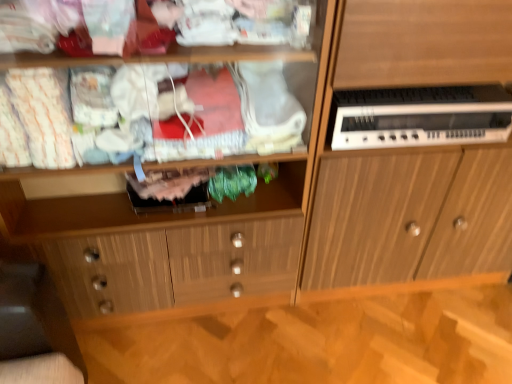
The width and height of the screenshot is (512, 384). In order to click on white plastic electronic device at right in this screenshot , I will do `click(421, 116)`.

Image resolution: width=512 pixels, height=384 pixels. Describe the element at coordinates (199, 139) in the screenshot. I see `wooden cabinet at center` at that location.

The height and width of the screenshot is (384, 512). What are the coordinates of `wooden cabinet at right` in the screenshot? It's located at (411, 159).

Does wooden cabinet at center appear on the right side of white plastic electronic device at right?

No.

Is wooden cabinet at center inside or outside of white plastic electronic device at right?

wooden cabinet at center lies outside white plastic electronic device at right.

The width and height of the screenshot is (512, 384). Find the location of `home appliance located behind the wooden cabinet at center`. home appliance located behind the wooden cabinet at center is located at coordinates (421, 116).

Can you confirm if wooden cabinet at center is positioned to the left of wooden cabinet at right?

Yes, wooden cabinet at center is to the left of wooden cabinet at right.

Between wooden cabinet at center and wooden cabinet at right, which one is positioned behind?

wooden cabinet at right is further from the camera.

Can you confirm if wooden cabinet at center is shorter than wooden cabinet at right?

Correct, wooden cabinet at center is not as tall as wooden cabinet at right.

From the image's perspective, is wooden cabinet at center located beneath wooden cabinet at right?

Correct, wooden cabinet at center appears lower than wooden cabinet at right in the image.

Is white plastic electronic device at right oriented towards wooden cabinet at right?

Yes.

Based on the photo, from the image's perspective, does white plastic electronic device at right appear higher than wooden cabinet at right?

Yes, from the image's perspective, white plastic electronic device at right is on top of wooden cabinet at right.

From a real-world perspective, which object stands above the other?

white plastic electronic device at right.

Is white plastic electronic device at right aimed at wooden cabinet at center?

No, white plastic electronic device at right does not turn towards wooden cabinet at center.

Measure the distance from white plastic electronic device at right to wooden cabinet at center.

15.62 inches.

Which object is closer to the camera, white plastic electronic device at right or wooden cabinet at center?

wooden cabinet at center is closer to the camera.

Is white plastic electronic device at right at the left side of wooden cabinet at center?

In fact, white plastic electronic device at right is to the right of wooden cabinet at center.

How many degrees apart are the facing directions of wooden cabinet at right and wooden cabinet at center?

0.566 degrees.

Considering their positions, is wooden cabinet at right located in front of or behind wooden cabinet at center?

wooden cabinet at right is positioned farther from the viewer than wooden cabinet at center.

From a real-world perspective, is wooden cabinet at right located higher than wooden cabinet at center?

No, from a real-world perspective, wooden cabinet at right is not above wooden cabinet at center.

Can you confirm if wooden cabinet at right is bigger than wooden cabinet at center?

Yes.

Where is `home appliance located above the wooden cabinet at right (from the image's perspective)`? Image resolution: width=512 pixels, height=384 pixels. home appliance located above the wooden cabinet at right (from the image's perspective) is located at coordinates (421, 116).

Between wooden cabinet at right and white plastic electronic device at right, which one has larger size?

wooden cabinet at right is bigger.

Is wooden cabinet at right positioned with its back to white plastic electronic device at right?

Yes, wooden cabinet at right is facing away from white plastic electronic device at right.

Is there a large distance between wooden cabinet at right and white plastic electronic device at right?

That's not correct — wooden cabinet at right is a little close to white plastic electronic device at right.

At what (x,y) coordinates should I click in order to perform the action: click on shelf that appears in front of the white plastic electronic device at right. Please return your answer as a coordinate pair (x, y). The height and width of the screenshot is (384, 512). Looking at the image, I should click on (199, 139).

Locate an element on the screen. The width and height of the screenshot is (512, 384). shelf on the left of wooden cabinet at right is located at coordinates (199, 139).

Which object lies further to the anchor point wooden cabinet at right, wooden cabinet at center or white plastic electronic device at right?

wooden cabinet at center is further to wooden cabinet at right.

Considering their positions, is wooden cabinet at right positioned further to white plastic electronic device at right than wooden cabinet at center?

Based on the image, wooden cabinet at center appears to be further to white plastic electronic device at right.

Which object lies nearer to the anchor point wooden cabinet at right, white plastic electronic device at right or wooden cabinet at center?

Among the two, white plastic electronic device at right is located nearer to wooden cabinet at right.

Based on their spatial positions, is white plastic electronic device at right or wooden cabinet at right closer to wooden cabinet at center?

Based on the image, wooden cabinet at right appears to be nearer to wooden cabinet at center.

Based on their spatial positions, is wooden cabinet at right or white plastic electronic device at right further from wooden cabinet at center?

Based on the image, white plastic electronic device at right appears to be further to wooden cabinet at center.

Based on the photo, estimate the real-world distances between objects in this image. Which object is further from white plastic electronic device at right, wooden cabinet at center or wooden cabinet at right?

Based on the image, wooden cabinet at center appears to be further to white plastic electronic device at right.

Identify the location of home appliance between wooden cabinet at center and wooden cabinet at right in the horizontal direction. (421, 116).